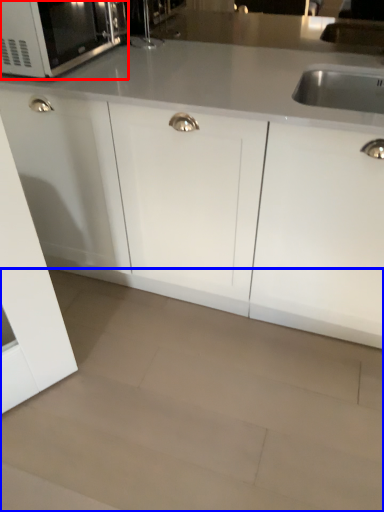
Question: Which object appears farthest to the camera in this image, microwave oven (highlighted by a red box) or granite (highlighted by a blue box)?

Choices:
 (A) microwave oven
 (B) granite

Answer: (A)